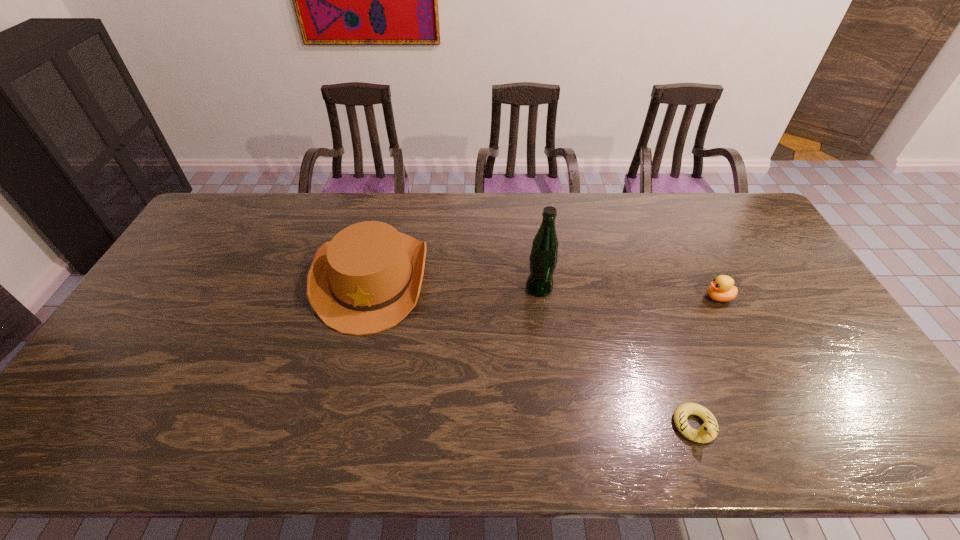
The image size is (960, 540). I want to click on object that is the third nearest to the second object from right to left, so click(x=367, y=279).

This screenshot has width=960, height=540. Identify the location of vacant space that satisfies the following two spatial constraints: 1. on the front-facing side of the leftmost object; 2. on the left side of the beer bottle. (370, 288).

Find the location of a particular element. The width and height of the screenshot is (960, 540). free spot that satisfies the following two spatial constraints: 1. on the face of the taller duckling; 2. on the face of the nearer duckling is located at coordinates (782, 426).

Identify the location of vacant region that satisfies the following two spatial constraints: 1. on the face of the taller duckling; 2. on the face of the left duckling. (782, 426).